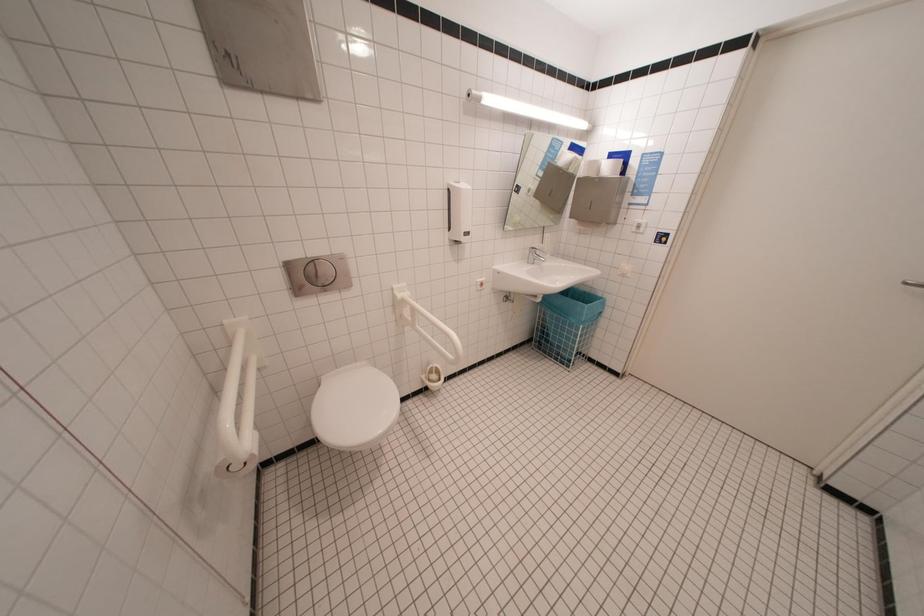
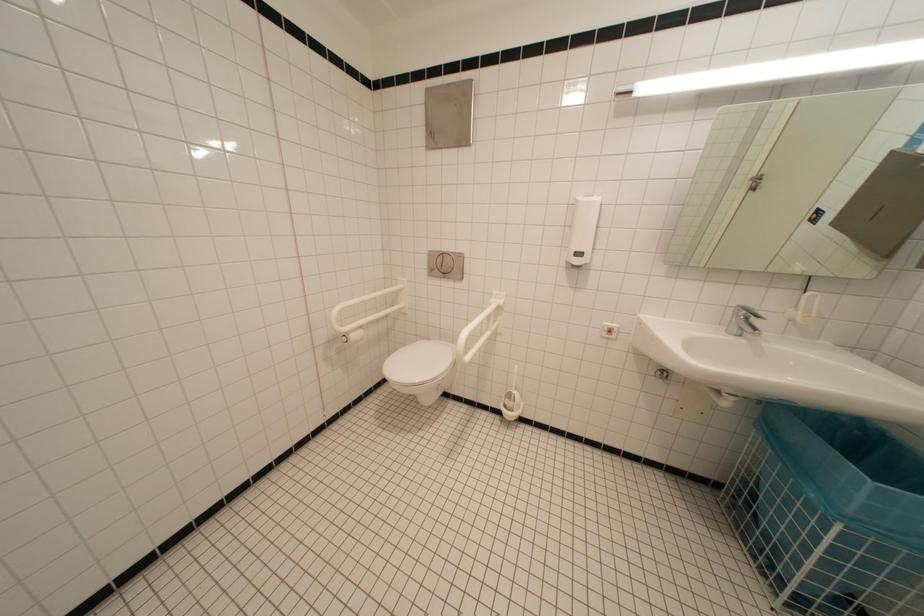
Question: The images are taken continuously from a first-person perspective. In which direction is your viewpoint rotating?

Choices:
 (A) Left
 (B) Right
 (C) Up
 (D) Down

Answer: (A)